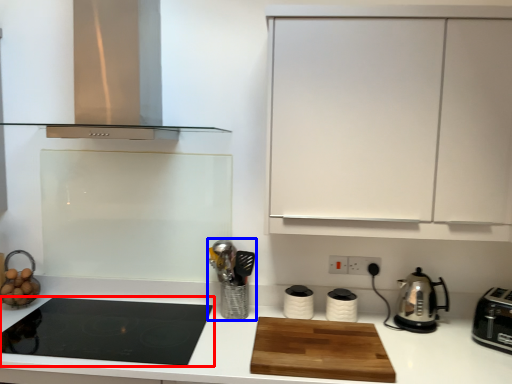
Question: Which object is further to the camera taking this photo, gas stove (highlighted by a red box) or appliance (highlighted by a blue box)?

Choices:
 (A) gas stove
 (B) appliance

Answer: (B)